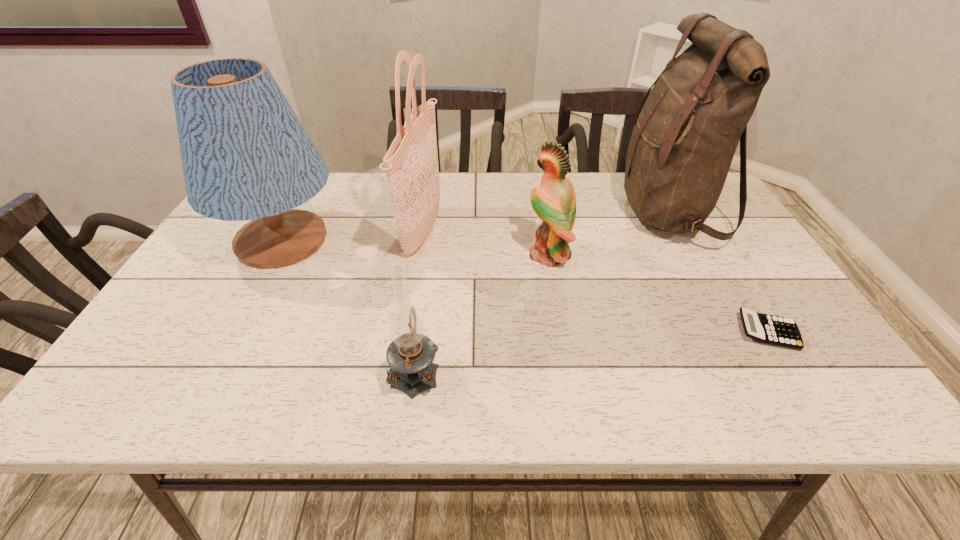
What are the coordinates of `unoccupied area between the shopping bag and the third object from right to left` in the screenshot? It's located at (485, 244).

At what (x,y) coordinates should I click in order to perform the action: click on free space between the shortest object and the shopping bag. Please return your answer as a coordinate pair (x, y). The image size is (960, 540). Looking at the image, I should click on (594, 282).

This screenshot has height=540, width=960. What are the coordinates of `free spot between the shopping bag and the parrot` in the screenshot? It's located at (485, 244).

At what (x,y) coordinates should I click in order to perform the action: click on vacant area that lies between the third object from right to left and the oil lamp. Please return your answer as a coordinate pair (x, y). The height and width of the screenshot is (540, 960). Looking at the image, I should click on (482, 313).

Locate an element on the screen. free area in between the calculator and the oil lamp is located at coordinates (591, 351).

What are the coordinates of `unoccupied position between the lampshade and the shopping bag` in the screenshot? It's located at (351, 236).

Identify the location of empty location between the oil lamp and the backpack. This screenshot has width=960, height=540. (541, 291).

Find the location of a particular element. This screenshot has width=960, height=540. object identified as the fourth closest to the oil lamp is located at coordinates (684, 139).

Locate an element on the screen. This screenshot has width=960, height=540. object that is the second closest one to the leftmost object is located at coordinates (410, 355).

What are the coordinates of `free space that satisfies the following two spatial constraints: 1. on the front-facing side of the parrot; 2. on the left side of the shortest object` in the screenshot? It's located at (563, 332).